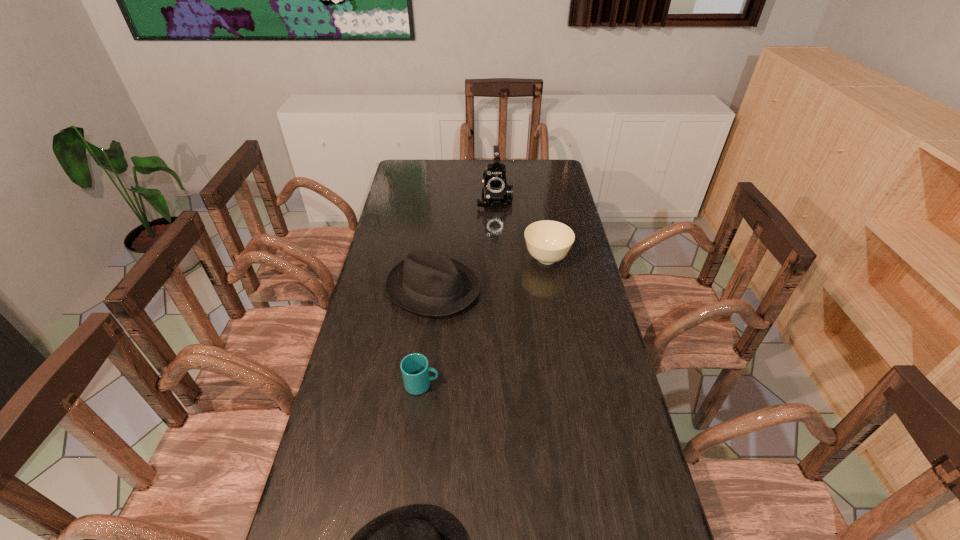
The height and width of the screenshot is (540, 960). Find the location of `free space located on the handle side of the cup`. free space located on the handle side of the cup is located at coordinates (506, 384).

You are a GUI agent. You are given a task and a screenshot of the screen. Output one action in this format:
    pyautogui.click(x=<x>, y=<y>)
    Task: Click on the object positioned at the left edge
    This screenshot has height=540, width=960.
    Given the screenshot: What is the action you would take?
    pyautogui.click(x=427, y=281)

You are a GUI agent. You are given a task and a screenshot of the screen. Output one action in this format:
    pyautogui.click(x=<x>, y=<y>)
    Task: Click on the object at the right edge
    The height and width of the screenshot is (540, 960).
    Given the screenshot: What is the action you would take?
    pyautogui.click(x=547, y=241)

The image size is (960, 540). Find the location of `vacant space at the far edge`. vacant space at the far edge is located at coordinates (514, 176).

Where is `free space at the left edge of the desktop`? This screenshot has height=540, width=960. free space at the left edge of the desktop is located at coordinates (395, 195).

Locate an element on the screen. The height and width of the screenshot is (540, 960). free space at the right edge of the desktop is located at coordinates coord(550,209).

In the image, there is a desktop. Where is `vacant space at the far right corner`? The image size is (960, 540). vacant space at the far right corner is located at coordinates (557, 181).

The width and height of the screenshot is (960, 540). I want to click on unoccupied position between the third tallest object and the farthest object, so click(520, 229).

Image resolution: width=960 pixels, height=540 pixels. In order to click on empty location between the second nearest object and the third tallest object in this screenshot , I will do `click(484, 321)`.

Locate an element on the screen. The height and width of the screenshot is (540, 960). empty space between the second tallest object and the farthest object is located at coordinates (464, 244).